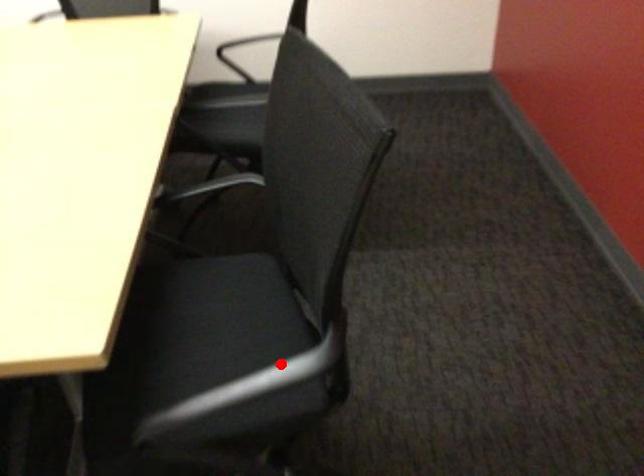
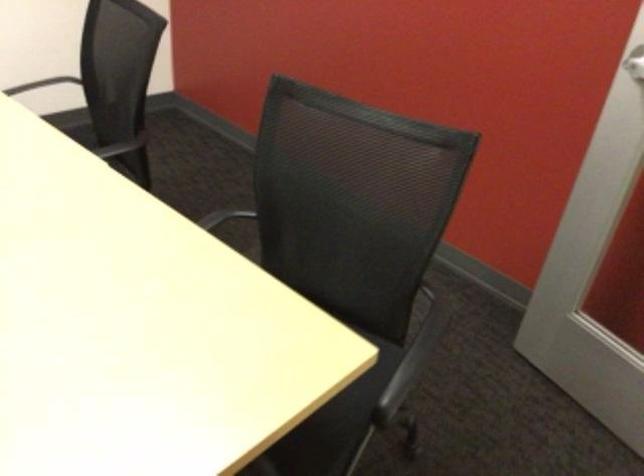
Where in the second image is the point corresponding to the highlighted location from the first image?

(430, 322)